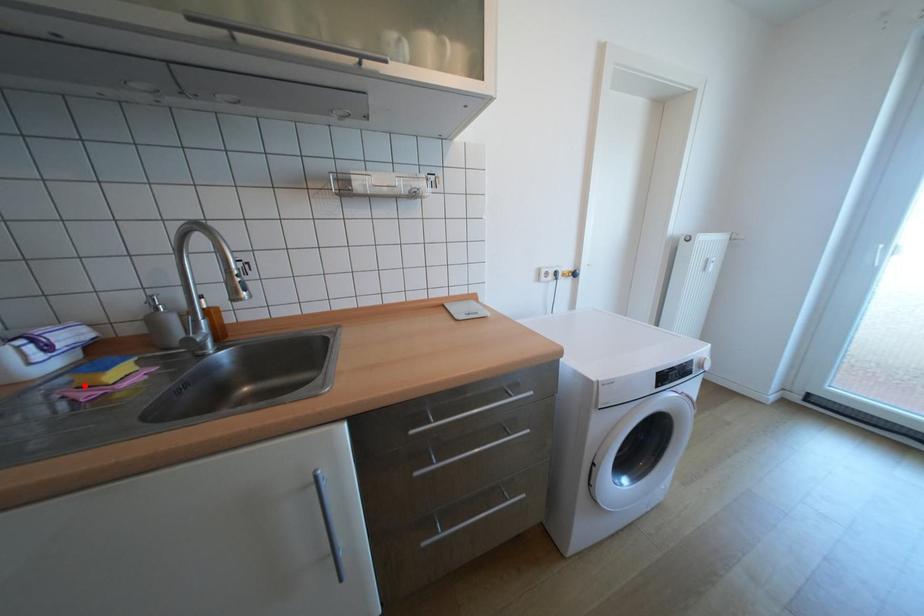
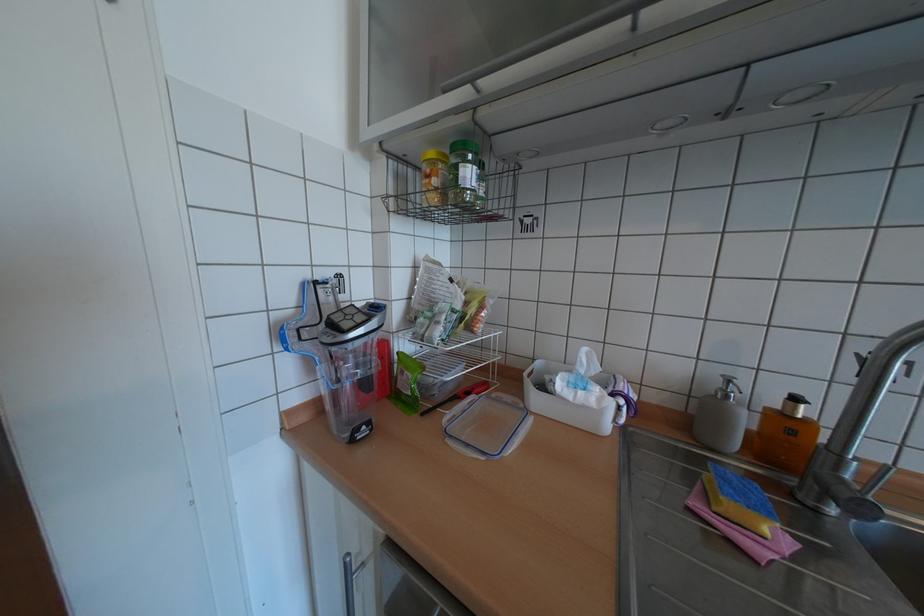
Find the pixel in the second image that matches the highlighted location in the first image.

(723, 508)